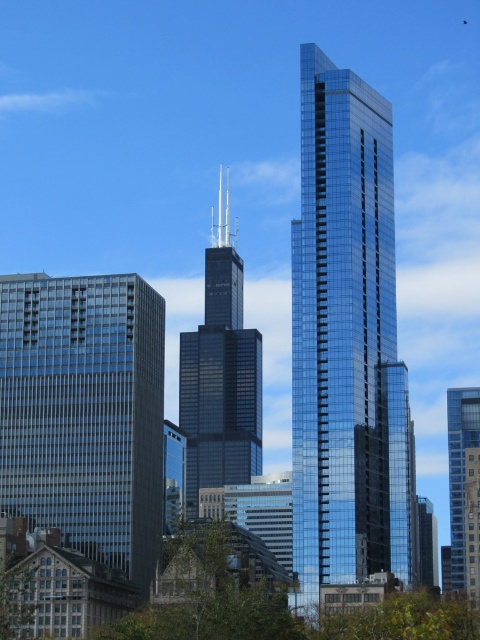
Question: Is shiny glass skyscraper at center bigger than glassy reflective skyscraper at left?

Choices:
 (A) no
 (B) yes

Answer: (B)

Question: Which point is closer to the camera?

Choices:
 (A) glassy reflective skyscraper at left
 (B) shiny glass skyscraper at center

Answer: (B)

Question: Which object is positioned farthest from the glassy reflective skyscraper at left?

Choices:
 (A) shiny glass skyscraper at center
 (B) glassy blue skyscraper at right

Answer: (B)

Question: Estimate the real-world distances between objects in this image. Which object is farther from the glassy reflective skyscraper at left?

Choices:
 (A) glassy blue skyscraper at right
 (B) black glass skyscraper at center
 (C) green leafy tree at lower left
 (D) shiny glass skyscraper at center

Answer: (B)

Question: Is black glass skyscraper at center closer to camera compared to green leafy tree at lower left?

Choices:
 (A) yes
 (B) no

Answer: (B)

Question: Can you confirm if shiny glass skyscraper at center is wider than glassy blue skyscraper at right?

Choices:
 (A) no
 (B) yes

Answer: (A)